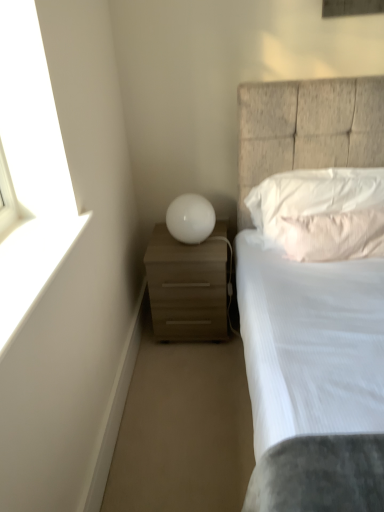
What do you see at coordinates (32, 265) in the screenshot? The width and height of the screenshot is (384, 512). I see `white matte window sill at upper left` at bounding box center [32, 265].

I want to click on pink textured pillow at upper right, which is the 2th pillow in top-to-bottom order, so click(x=332, y=234).

This screenshot has width=384, height=512. I want to click on white soft pillow at upper right, the 1th pillow when ordered from top to bottom, so click(x=322, y=213).

This screenshot has height=512, width=384. What are the coordinates of `white matte window sill at upper left` in the screenshot? It's located at (32, 265).

From a real-world perspective, relative to white textured bed at center, is white matte window sill at upper left vertically above or below?

Clearly, from a real-world perspective, white matte window sill at upper left is above white textured bed at center.

Considering the relative positions of white matte window sill at upper left and white textured bed at center in the image provided, is white matte window sill at upper left behind white textured bed at center?

That is True.

Is white matte window sill at upper left oriented towards white textured bed at center?

Yes, white matte window sill at upper left is oriented towards white textured bed at center.

Consider the image. Which object is positioned more to the left, white textured bed at center or white soft pillow at upper right, the 1th pillow when ordered from top to bottom?

From the viewer's perspective, white textured bed at center appears more on the left side.

Does point (383, 160) appear closer or farther from the camera than point (319, 188)?

Point (383, 160) is farther from the camera than point (319, 188).

Is white soft pillow at upper right, the 2th pillow ordered from the bottom, at the back of white textured bed at center?

Correct, white textured bed at center is looking away from white soft pillow at upper right, the 2th pillow ordered from the bottom.

From the image's perspective, which object appears higher, white textured bed at center or white soft pillow at upper right, the 2th pillow ordered from the bottom?

white soft pillow at upper right, the 2th pillow ordered from the bottom.

From a real-world perspective, is white soft pillow at upper right, the 1th pillow when ordered from top to bottom, under white glossy sphere at center?

No, from a real-world perspective, white soft pillow at upper right, the 1th pillow when ordered from top to bottom, is not beneath white glossy sphere at center.

From the image's perspective, does white soft pillow at upper right, the 1th pillow when ordered from top to bottom, appear lower than white glossy sphere at center?

Incorrect, from the image's perspective, white soft pillow at upper right, the 1th pillow when ordered from top to bottom, is higher than white glossy sphere at center.

Considering the sizes of white soft pillow at upper right, the 2th pillow ordered from the bottom, and white glossy sphere at center in the image, is white soft pillow at upper right, the 2th pillow ordered from the bottom, bigger or smaller than white glossy sphere at center?

In the image, white soft pillow at upper right, the 2th pillow ordered from the bottom, appears to be larger than white glossy sphere at center.

Which of these two, white soft pillow at upper right, the 1th pillow when ordered from top to bottom, or white glossy sphere at center, is thinner?

Thinner between the two is white soft pillow at upper right, the 1th pillow when ordered from top to bottom.

Would you say pink textured pillow at upper right, which is the 2th pillow in top-to-bottom order, is inside or outside white matte window sill at upper left?

The correct answer is: outside.

Based on the photo, does pink textured pillow at upper right, which appears as the first pillow when ordered from the bottom, have a greater height compared to white matte window sill at upper left?

Correct, pink textured pillow at upper right, which appears as the first pillow when ordered from the bottom, is much taller as white matte window sill at upper left.

Is pink textured pillow at upper right, which is the 2th pillow in top-to-bottom order, further to the viewer compared to white matte window sill at upper left?

Yes, pink textured pillow at upper right, which is the 2th pillow in top-to-bottom order, is further from the camera.

Between pink textured pillow at upper right, which is the 2th pillow in top-to-bottom order, and white matte window sill at upper left, which one has smaller width?

Thinner between the two is pink textured pillow at upper right, which is the 2th pillow in top-to-bottom order.

From a real-world perspective, between white textured bed at center and white glossy sphere at center, who is vertically higher?

white glossy sphere at center is physically above.

Which object is positioned more to the left, white textured bed at center or white glossy sphere at center?

From the viewer's perspective, white glossy sphere at center appears more on the left side.

At what (x,y) coordinates should I click in order to perform the action: click on bed lying in front of the white glossy sphere at center. Please return your answer as a coordinate pair (x, y). Looking at the image, I should click on (307, 129).

In terms of width, does white textured bed at center look wider or thinner when compared to white glossy sphere at center?

Clearly, white textured bed at center has more width compared to white glossy sphere at center.

Considering the sizes of objects white matte window sill at upper left and white soft pillow at upper right, the 2th pillow ordered from the bottom, in the image provided, who is wider, white matte window sill at upper left or white soft pillow at upper right, the 2th pillow ordered from the bottom,?

With larger width is white matte window sill at upper left.

Is white matte window sill at upper left smaller than white soft pillow at upper right, the 2th pillow ordered from the bottom?

Indeed, white matte window sill at upper left has a smaller size compared to white soft pillow at upper right, the 2th pillow ordered from the bottom.

From the image's perspective, between white matte window sill at upper left and white soft pillow at upper right, the 2th pillow ordered from the bottom, which one is located above?

white soft pillow at upper right, the 2th pillow ordered from the bottom, from the image's perspective.

From a real-world perspective, who is located lower, white matte window sill at upper left or white soft pillow at upper right, the 1th pillow when ordered from top to bottom?

white soft pillow at upper right, the 1th pillow when ordered from top to bottom, is physically lower.

Which of these two, white soft pillow at upper right, the 2th pillow ordered from the bottom, or white textured bed at center, is smaller?

With smaller size is white soft pillow at upper right, the 2th pillow ordered from the bottom.

In the scene shown: From the image's perspective, does white soft pillow at upper right, the 2th pillow ordered from the bottom, appear lower than white textured bed at center?

No.

Between white soft pillow at upper right, the 2th pillow ordered from the bottom, and white textured bed at center, which one has less height?

white soft pillow at upper right, the 2th pillow ordered from the bottom.

Does white soft pillow at upper right, the 1th pillow when ordered from top to bottom, have a lesser width compared to white textured bed at center?

Yes, white soft pillow at upper right, the 1th pillow when ordered from top to bottom, is thinner than white textured bed at center.

Find the location of `window sill above the white textured bed at center (from a real-world perspective)`. window sill above the white textured bed at center (from a real-world perspective) is located at coordinates (32, 265).

What are the coordinates of `pillow that is the 1st object to the right of the white textured bed at center, starting at the anchor` in the screenshot? It's located at (322, 213).

Considering their positions, is matte wood nightstand at lower left positioned further to pink textured pillow at upper right, which is the 2th pillow in top-to-bottom order, than white soft pillow at upper right, the 2th pillow ordered from the bottom?

Based on the image, matte wood nightstand at lower left appears to be further to pink textured pillow at upper right, which is the 2th pillow in top-to-bottom order.

Looking at the image, which one is located closer to white glossy sphere at center, white matte window sill at upper left or white textured bed at center?

Among the two, white textured bed at center is located nearer to white glossy sphere at center.

Which object lies further to the anchor point matte wood nightstand at lower left, white textured bed at center or pink textured pillow at upper right, which appears as the first pillow when ordered from the bottom?

pink textured pillow at upper right, which appears as the first pillow when ordered from the bottom, is further to matte wood nightstand at lower left.

Estimate the real-world distances between objects in this image. Which object is closer to white textured bed at center, white soft pillow at upper right, the 2th pillow ordered from the bottom, or pink textured pillow at upper right, which appears as the first pillow when ordered from the bottom?

The object closer to white textured bed at center is white soft pillow at upper right, the 2th pillow ordered from the bottom.

Which object lies nearer to the anchor point white matte window sill at upper left, white soft pillow at upper right, the 1th pillow when ordered from top to bottom, or pink textured pillow at upper right, which is the 2th pillow in top-to-bottom order?

Among the two, pink textured pillow at upper right, which is the 2th pillow in top-to-bottom order, is located nearer to white matte window sill at upper left.

Looking at the image, which one is located further to white textured bed at center, white matte window sill at upper left or white soft pillow at upper right, the 1th pillow when ordered from top to bottom?

The object further to white textured bed at center is white matte window sill at upper left.

From the picture: Which object lies nearer to the anchor point matte wood nightstand at lower left, white glossy sphere at center or pink textured pillow at upper right, which is the 2th pillow in top-to-bottom order?

Among the two, white glossy sphere at center is located nearer to matte wood nightstand at lower left.

Based on their spatial positions, is matte wood nightstand at lower left or white glossy sphere at center closer to white soft pillow at upper right, the 1th pillow when ordered from top to bottom?

The object closer to white soft pillow at upper right, the 1th pillow when ordered from top to bottom, is white glossy sphere at center.

Where is `pillow located between matte wood nightstand at lower left and pink textured pillow at upper right, which is the 2th pillow in top-to-bottom order, in the left-right direction`? The width and height of the screenshot is (384, 512). pillow located between matte wood nightstand at lower left and pink textured pillow at upper right, which is the 2th pillow in top-to-bottom order, in the left-right direction is located at coordinates point(322,213).

What are the coordinates of `table lamp positioned between white textured bed at center and matte wood nightstand at lower left from near to far` in the screenshot? It's located at (190, 218).

You are a GUI agent. You are given a task and a screenshot of the screen. Output one action in this format:
    pyautogui.click(x=<x>, y=<y>)
    Task: Click on the window sill located between white textured bed at center and white soft pillow at upper right, the 1th pillow when ordered from top to bottom, in the depth direction
    The image size is (384, 512).
    Given the screenshot: What is the action you would take?
    pyautogui.click(x=32, y=265)

At what (x,y) coordinates should I click in order to perform the action: click on pillow between white glossy sphere at center and pink textured pillow at upper right, which is the 2th pillow in top-to-bottom order, from left to right. Please return your answer as a coordinate pair (x, y). Image resolution: width=384 pixels, height=512 pixels. Looking at the image, I should click on (322, 213).